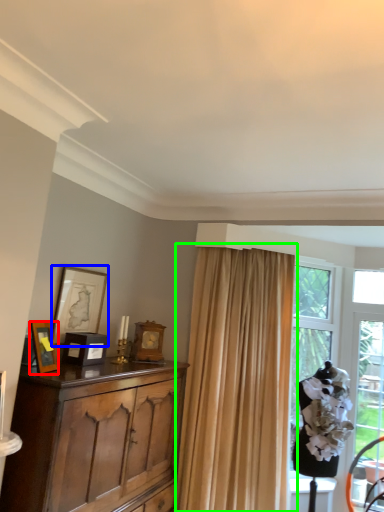
Question: Which is nearer to the picture frame (highlighted by a red box)? picture frame (highlighted by a blue box) or curtain (highlighted by a green box).

Choices:
 (A) picture frame
 (B) curtain

Answer: (A)